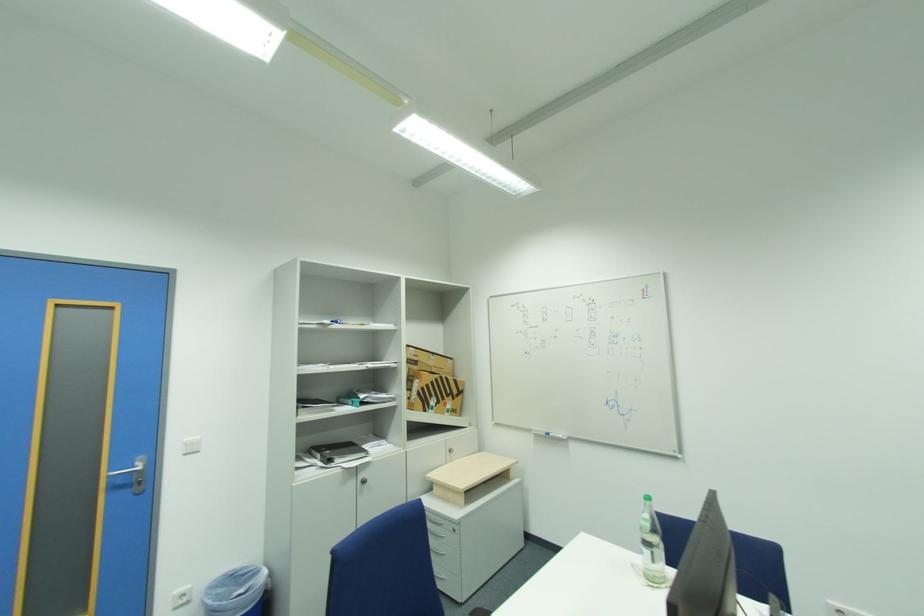
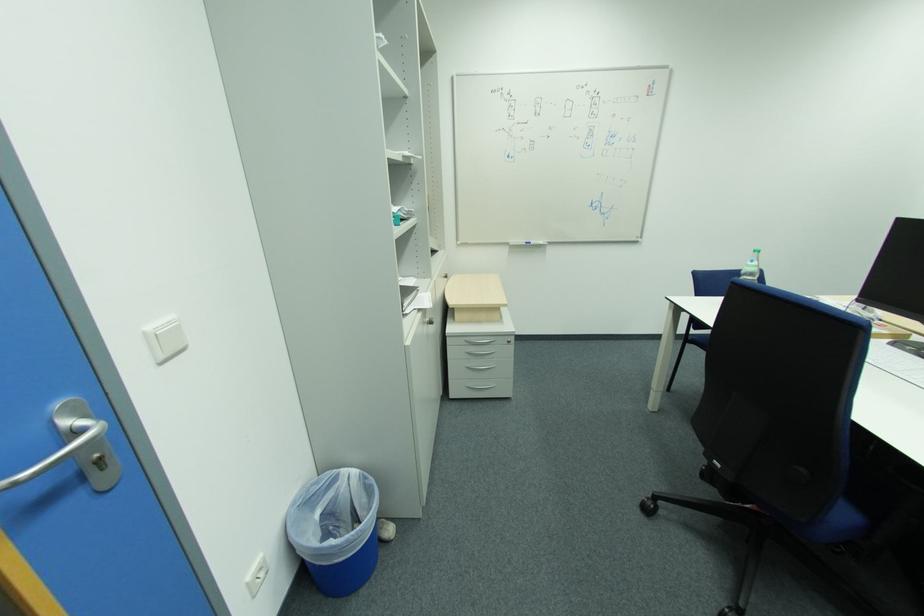
Find the pixel in the second image that matches the point at 191,440 in the first image.

(154, 329)